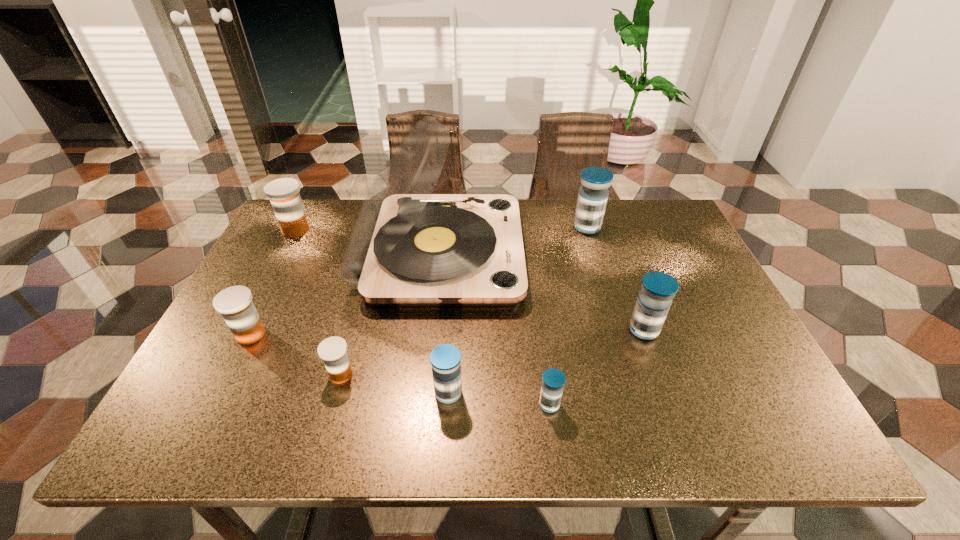
Locate which blue medicine is the third closest to the third medicine from right to left. Please provide its 2D coordinates. Your answer should be formatted as a tuple, i.e. [(x, y)], where the tuple contains the x and y coordinates of a point satisfying the conditions above.

[(593, 194)]

Identify which orange medicine is the second nearest to the biggest orange medicine. Please provide its 2D coordinates. Your answer should be formatted as a tuple, i.e. [(x, y)], where the tuple contains the x and y coordinates of a point satisfying the conditions above.

[(333, 351)]

Where is `orange medicine that stands as the third closest to the sixth object from left to right`? orange medicine that stands as the third closest to the sixth object from left to right is located at coordinates (284, 195).

Image resolution: width=960 pixels, height=540 pixels. I want to click on free space that satisfies the following two spatial constraints: 1. on the label of the second blue medicine from left to right; 2. on the right side of the second biggest orange medicine, so click(215, 404).

You are a GUI agent. You are given a task and a screenshot of the screen. Output one action in this format:
    pyautogui.click(x=<x>, y=<y>)
    Task: Click on the vacant area that satisfies the following two spatial constraints: 1. on the label of the third blue medicine from right to left; 2. on the right side of the farthest orange medicine
    This screenshot has height=540, width=960.
    Given the screenshot: What is the action you would take?
    pyautogui.click(x=204, y=404)

The height and width of the screenshot is (540, 960). In order to click on free location that satisfies the following two spatial constraints: 1. with the tonearm facing the front of the record player; 2. on the right side of the smallest blue medicine in this screenshot , I will do `click(425, 404)`.

The image size is (960, 540). In order to click on free space in the image that satisfies the following two spatial constraints: 1. on the label of the third medicine from left to right; 2. on the left side of the fifth medicine from left to right in this screenshot , I will do `click(332, 404)`.

The height and width of the screenshot is (540, 960). I want to click on free spot that satisfies the following two spatial constraints: 1. on the label of the second blue medicine from left to right; 2. on the left side of the third medicine from left to right, so click(x=332, y=404).

Identify the location of free space that satisfies the following two spatial constraints: 1. with the tonearm facing the front of the record player; 2. on the back side of the leftmost blue medicine. The width and height of the screenshot is (960, 540). (426, 393).

At what (x,y) coordinates should I click in order to perform the action: click on free space that satisfies the following two spatial constraints: 1. on the label of the biggest orange medicine; 2. on the left side of the sixth object from left to right. Please return your answer as a coordinate pair (x, y). The width and height of the screenshot is (960, 540). Looking at the image, I should click on (204, 404).